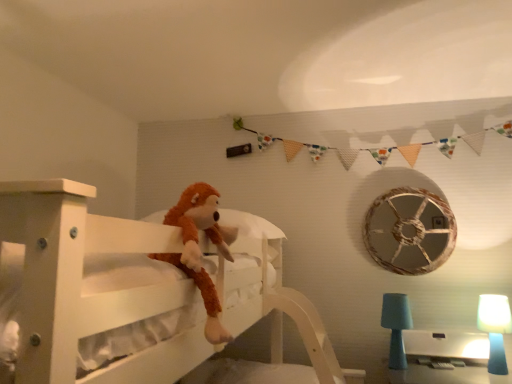
Question: Considering the relative sizes of blue matte table lamp at lower right, the second table lamp positioned from the left, and brown plush toy at center in the image provided, is blue matte table lamp at lower right, the second table lamp positioned from the left, taller than brown plush toy at center?

Choices:
 (A) yes
 (B) no

Answer: (B)

Question: Is blue matte table lamp at lower right, the second table lamp positioned from the left, positioned far away from brown plush toy at center?

Choices:
 (A) no
 (B) yes

Answer: (B)

Question: Is blue matte table lamp at lower right, positioned as the 1th table lamp in right-to-left order, in contact with brown plush toy at center?

Choices:
 (A) yes
 (B) no

Answer: (B)

Question: From a real-world perspective, is blue matte table lamp at lower right, the second table lamp positioned from the left, physically above brown plush toy at center?

Choices:
 (A) no
 (B) yes

Answer: (A)

Question: From a real-world perspective, is blue matte table lamp at lower right, the second table lamp positioned from the left, beneath brown plush toy at center?

Choices:
 (A) no
 (B) yes

Answer: (B)

Question: Choose the correct answer: Is brown plush toy at center inside white wooden bed at center or outside it?

Choices:
 (A) outside
 (B) inside

Answer: (B)

Question: Relative to white wooden bed at center, is brown plush toy at center in front or behind?

Choices:
 (A) front
 (B) behind

Answer: (B)

Question: Is brown plush toy at center wider or thinner than white wooden bed at center?

Choices:
 (A) thin
 (B) wide

Answer: (A)

Question: Is point (162, 223) closer or farther from the camera than point (170, 281)?

Choices:
 (A) farther
 (B) closer

Answer: (A)

Question: In the image, is blue matte table lamp at lower right, the second table lamp positioned from the left, on the left side or the right side of teal fabric lampshade at lower right, marked as the 2th table lamp in a right-to-left arrangement?

Choices:
 (A) left
 (B) right

Answer: (B)

Question: Considering their positions, is blue matte table lamp at lower right, the second table lamp positioned from the left, located in front of or behind teal fabric lampshade at lower right, marked as the 2th table lamp in a right-to-left arrangement?

Choices:
 (A) behind
 (B) front

Answer: (B)

Question: Does point (494, 299) appear closer or farther from the camera than point (381, 307)?

Choices:
 (A) farther
 (B) closer

Answer: (B)

Question: From a real-world perspective, is blue matte table lamp at lower right, positioned as the 1th table lamp in right-to-left order, physically located above or below teal fabric lampshade at lower right, the 1th table lamp from the left?

Choices:
 (A) above
 (B) below

Answer: (B)

Question: Considering the positions of teal fabric lampshade at lower right, the 1th table lamp from the left, and brown plush toy at center in the image, is teal fabric lampshade at lower right, the 1th table lamp from the left, bigger or smaller than brown plush toy at center?

Choices:
 (A) big
 (B) small

Answer: (B)

Question: Is point (392, 352) positioned closer to the camera than point (186, 206)?

Choices:
 (A) closer
 (B) farther

Answer: (B)